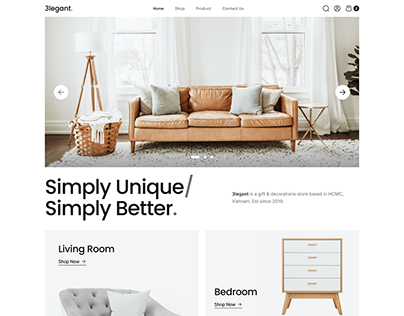
Where is `side table`? side table is located at coordinates (319, 106).